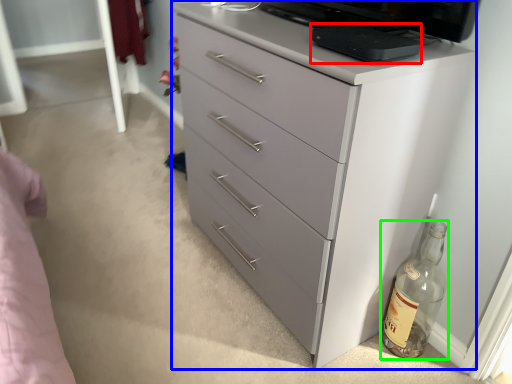
Question: Which object is the farthest from appliance (highlighted by a red box)? Choose among these: chest of drawers (highlighted by a blue box) or bottle (highlighted by a green box).

Choices:
 (A) chest of drawers
 (B) bottle

Answer: (B)